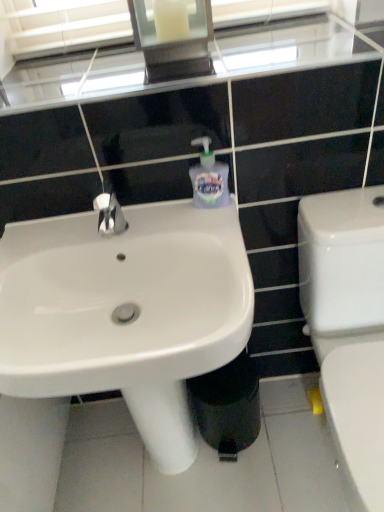
Question: From the image's perspective, would you say black plastic trash bin/can at lower center is shown under white glossy toilet at right?

Choices:
 (A) yes
 (B) no

Answer: (A)

Question: Considering the relative sizes of black plastic trash bin/can at lower center and white glossy toilet at right in the image provided, is black plastic trash bin/can at lower center shorter than white glossy toilet at right?

Choices:
 (A) yes
 (B) no

Answer: (A)

Question: From the image's perspective, is black plastic trash bin/can at lower center over white glossy toilet at right?

Choices:
 (A) yes
 (B) no

Answer: (B)

Question: Is black plastic trash bin/can at lower center bigger than white glossy toilet at right?

Choices:
 (A) no
 (B) yes

Answer: (A)

Question: Is black plastic trash bin/can at lower center to the left of white glossy toilet at right from the viewer's perspective?

Choices:
 (A) no
 (B) yes

Answer: (B)

Question: Considering their positions, is translucent plastic soap dispenser at center located in front of or behind white glossy toilet at right?

Choices:
 (A) behind
 (B) front

Answer: (A)

Question: From a real-world perspective, is translucent plastic soap dispenser at center above or below white glossy toilet at right?

Choices:
 (A) below
 (B) above

Answer: (B)

Question: Is translucent plastic soap dispenser at center bigger or smaller than white glossy toilet at right?

Choices:
 (A) big
 (B) small

Answer: (B)

Question: Is translucent plastic soap dispenser at center inside the boundaries of white glossy toilet at right, or outside?

Choices:
 (A) inside
 (B) outside

Answer: (B)

Question: From a real-world perspective, is white glossy sink at center above or below translucent plastic soap dispenser at center?

Choices:
 (A) below
 (B) above

Answer: (A)

Question: Looking at their shapes, would you say white glossy sink at center is wider or thinner than translucent plastic soap dispenser at center?

Choices:
 (A) wide
 (B) thin

Answer: (A)

Question: In the image, is white glossy sink at center on the left side or the right side of translucent plastic soap dispenser at center?

Choices:
 (A) right
 (B) left

Answer: (B)

Question: Is white glossy sink at center spatially inside translucent plastic soap dispenser at center, or outside of it?

Choices:
 (A) inside
 (B) outside

Answer: (B)

Question: Is translucent plastic soap dispenser at center to the left or to the right of white glossy sink at center in the image?

Choices:
 (A) left
 (B) right

Answer: (B)

Question: From a real-world perspective, is translucent plastic soap dispenser at center above or below white glossy sink at center?

Choices:
 (A) below
 (B) above

Answer: (B)